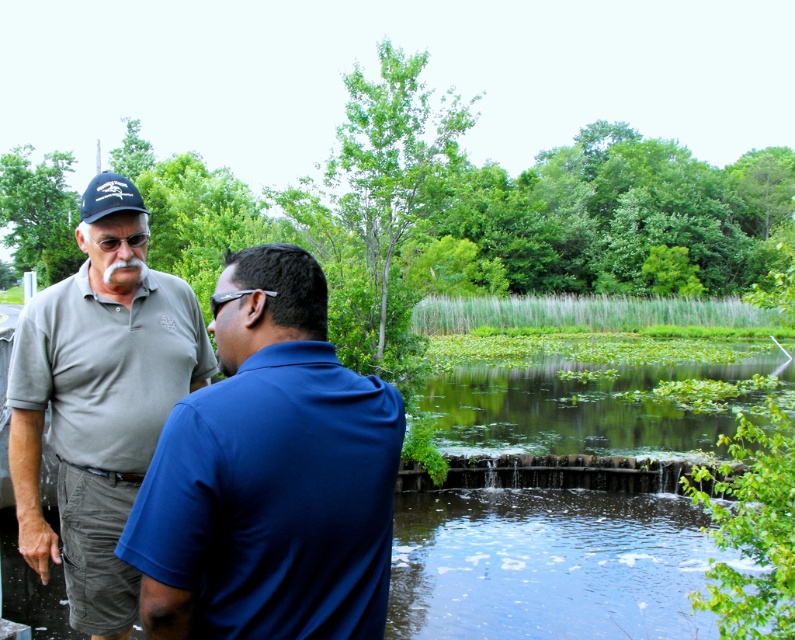
In the scene shown: You are standing at the edge of the pond and need to reach the point marked as point (291, 476). Can you safely walk to that point if your maximum comfortable walking distance is 5 feet?

The distance between you and point (291, 476) is 5.03 feet, which is slightly beyond your maximum comfortable walking distance of 5 feet. Therefore, it might be challenging to reach that point comfortably.

You are a fashion designer observing two polo shirts in the image. The matte gray polo shirt at center and the gray cotton polo shirt at left. Which one is smaller in size?

The matte gray polo shirt at center has a smaller size compared to the gray cotton polo shirt at left.